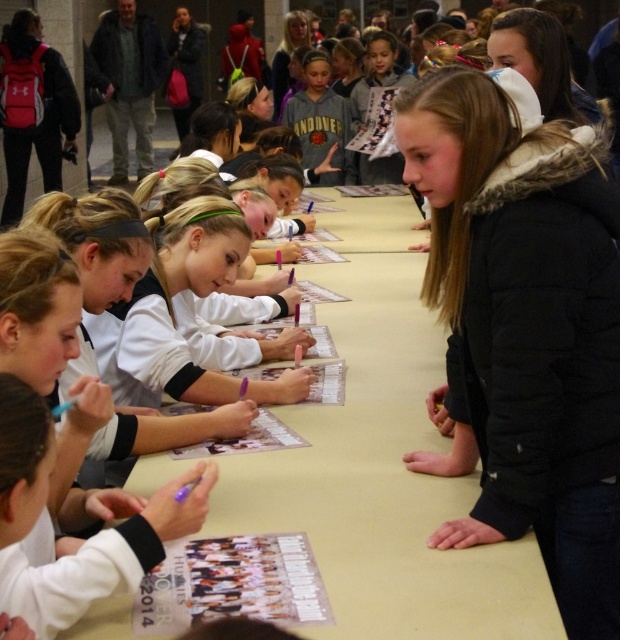
You are standing in front of the signing session table and want to reach both the point at location [562,545] and the point at [360,234]. Which point should you reach for first if you want to touch the closer one first?

The point at [562,545] is closer to you than the point at [360,234], so you should reach for the point at [562,545] first.

You are a student at the signing event and need to place your autograph on the beige paper at center. Where should you position your signature relative to the gray hoodie at center?

The beige paper at center is to the right of the gray hoodie at center, so you should sign to the right side of the gray hoodie at center.